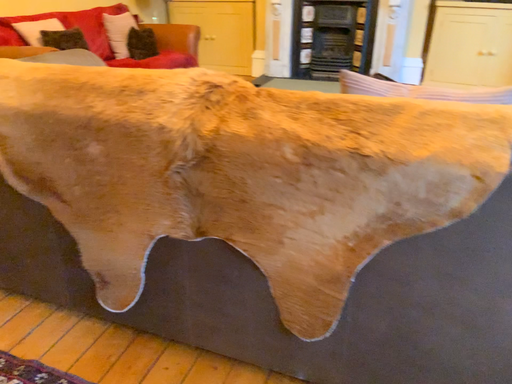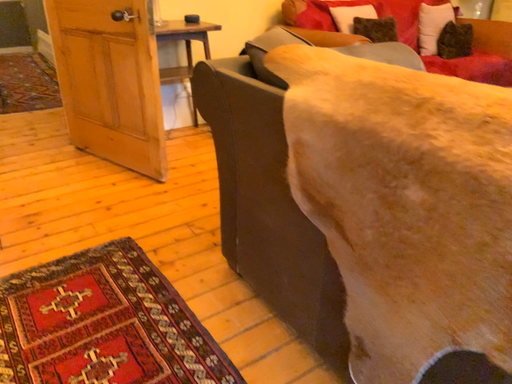
Question: How did the camera likely rotate when shooting the video?

Choices:
 (A) rotated right
 (B) rotated left

Answer: (B)